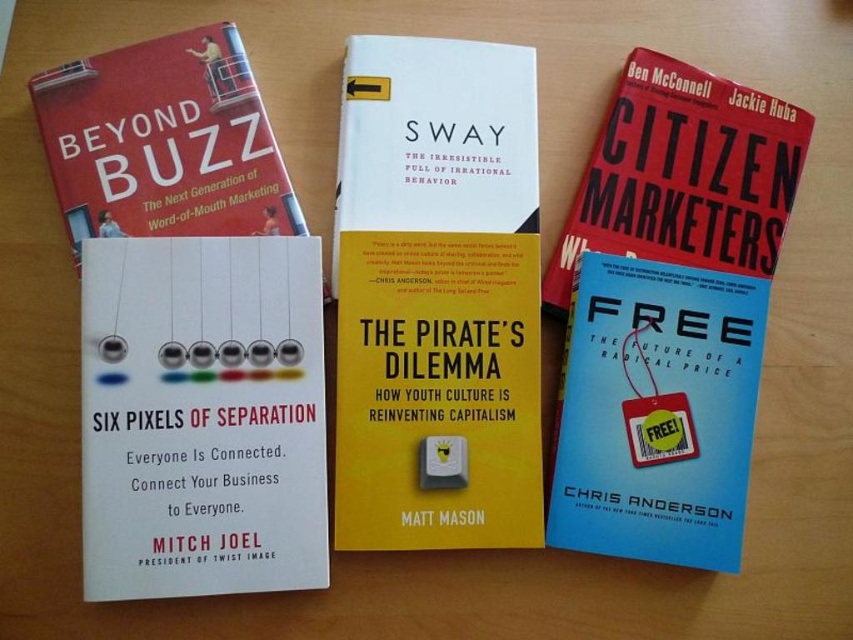
Consider the image. Which is above, yellow matte book at center or blue matte book at center?

Positioned higher is yellow matte book at center.

Can you confirm if yellow matte book at center is thinner than blue matte book at center?

Yes, yellow matte book at center is thinner than blue matte book at center.

Is point (415, 36) positioned before point (653, 515)?

No, (415, 36) is further to viewer.

The image size is (853, 640). What are the coordinates of `yellow matte book at center` in the screenshot? It's located at (437, 296).

Who is higher up, yellow matte book at center or matte red book at upper left?

matte red book at upper left

Between point (350, 92) and point (173, 118), which one is positioned behind?

Positioned behind is point (350, 92).

Between point (422, 60) and point (97, 84), which one is positioned in front?

Point (97, 84)

You are a GUI agent. You are given a task and a screenshot of the screen. Output one action in this format:
    pyautogui.click(x=<x>, y=<y>)
    Task: Click on the yellow matte book at center
    Image resolution: width=853 pixels, height=640 pixels.
    Given the screenshot: What is the action you would take?
    pyautogui.click(x=437, y=296)

Who is higher up, blue matte book at center or matte red book at upper left?

Positioned higher is matte red book at upper left.

Describe the element at coordinates (668, 314) in the screenshot. I see `blue matte book at center` at that location.

Find the location of a particular element. blue matte book at center is located at coordinates [x=668, y=314].